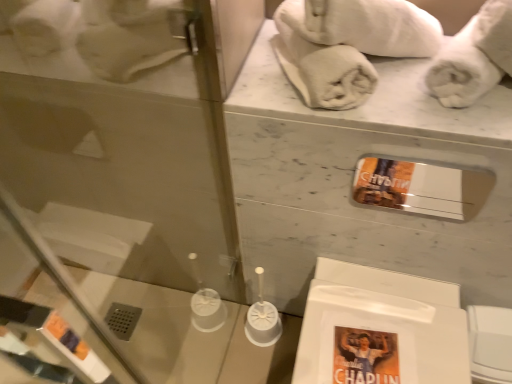
Question: Is white soft towel at upper right, the second bath towel when ordered from left to right, located outside white cotton towel at upper center, the 3th bath towel positioned from the right?

Choices:
 (A) no
 (B) yes

Answer: (B)

Question: Could you tell me if white soft towel at upper right, the second bath towel in the right-to-left sequence, is turned towards white cotton towel at upper center, the 3th bath towel positioned from the right?

Choices:
 (A) no
 (B) yes

Answer: (B)

Question: Considering the relative sizes of white soft towel at upper right, the second bath towel when ordered from left to right, and white cotton towel at upper center, which is the 1th bath towel in left-to-right order, in the image provided, is white soft towel at upper right, the second bath towel when ordered from left to right, smaller than white cotton towel at upper center, which is the 1th bath towel in left-to-right order,?

Choices:
 (A) no
 (B) yes

Answer: (A)

Question: Does white soft towel at upper right, the second bath towel when ordered from left to right, have a greater width compared to white cotton towel at upper center, which is the 1th bath towel in left-to-right order?

Choices:
 (A) yes
 (B) no

Answer: (B)

Question: Would you say white cotton towel at upper center, which is the 1th bath towel in left-to-right order, is part of white soft towel at upper right, the second bath towel in the right-to-left sequence,'s contents?

Choices:
 (A) yes
 (B) no

Answer: (A)

Question: From the image's perspective, is white soft towel at upper right, the second bath towel in the right-to-left sequence, on white cotton towel at upper center, the 3th bath towel positioned from the right?

Choices:
 (A) yes
 (B) no

Answer: (A)

Question: Is white fluffy towel at upper right, arranged as the 3th bath towel when viewed from the left, at the back of white cotton towel at upper center, the 3th bath towel positioned from the right?

Choices:
 (A) yes
 (B) no

Answer: (B)

Question: Is white cotton towel at upper center, the 3th bath towel positioned from the right, shorter than white fluffy towel at upper right, acting as the first bath towel starting from the right?

Choices:
 (A) no
 (B) yes

Answer: (A)

Question: Is white cotton towel at upper center, the 3th bath towel positioned from the right, not near white fluffy towel at upper right, acting as the first bath towel starting from the right?

Choices:
 (A) no
 (B) yes

Answer: (A)

Question: Is white cotton towel at upper center, the 3th bath towel positioned from the right, positioned beyond the bounds of white fluffy towel at upper right, acting as the first bath towel starting from the right?

Choices:
 (A) yes
 (B) no

Answer: (A)

Question: From a real-world perspective, is white cotton towel at upper center, which is the 1th bath towel in left-to-right order, positioned under white fluffy towel at upper right, arranged as the 3th bath towel when viewed from the left, based on gravity?

Choices:
 (A) no
 (B) yes

Answer: (B)

Question: Considering the relative positions of white cotton towel at upper center, the 3th bath towel positioned from the right, and white fluffy towel at upper right, arranged as the 3th bath towel when viewed from the left, in the image provided, is white cotton towel at upper center, the 3th bath towel positioned from the right, behind white fluffy towel at upper right, arranged as the 3th bath towel when viewed from the left,?

Choices:
 (A) yes
 (B) no

Answer: (A)

Question: Could white cotton towel at upper center, the 3th bath towel positioned from the right, be considered to be inside white fluffy towel at upper right, arranged as the 3th bath towel when viewed from the left?

Choices:
 (A) yes
 (B) no

Answer: (B)